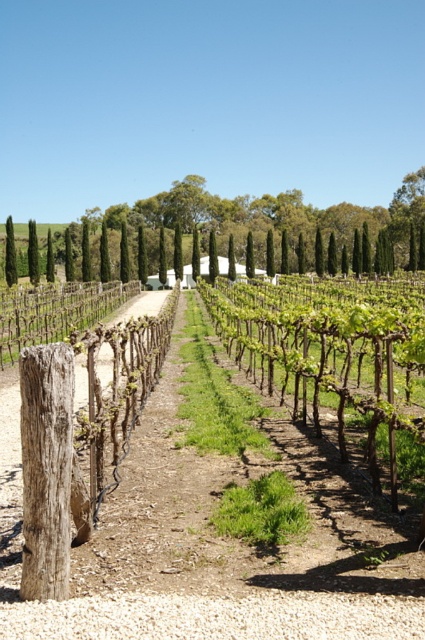
You are planning to install a new pathway between the brown wooden fence at center and the green textured cypress at left. Given their widths, which object requires more space to accommodate on either side?

The brown wooden fence at center requires more space because its width is larger than the green textured cypress at left.

You are a gardener who needs to install a new trellis system between the brown wooden fence at center and the green textured cypress at left. Considering their heights, which object will require a taller trellis system?

The green textured cypress at left requires a taller trellis system because the brown wooden fence at center is not as tall as the green textured cypress at left.